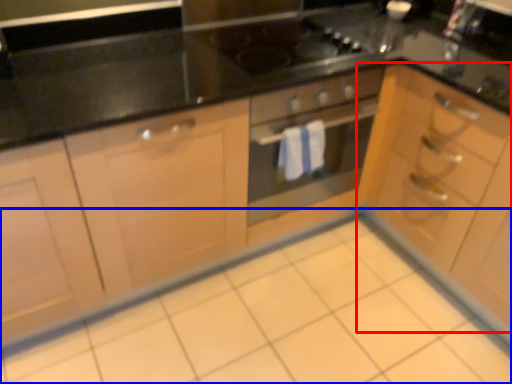
Question: Which object appears farthest to the camera in this image, cabinetry (highlighted by a red box) or ceramic tile (highlighted by a blue box)?

Choices:
 (A) cabinetry
 (B) ceramic tile

Answer: (A)